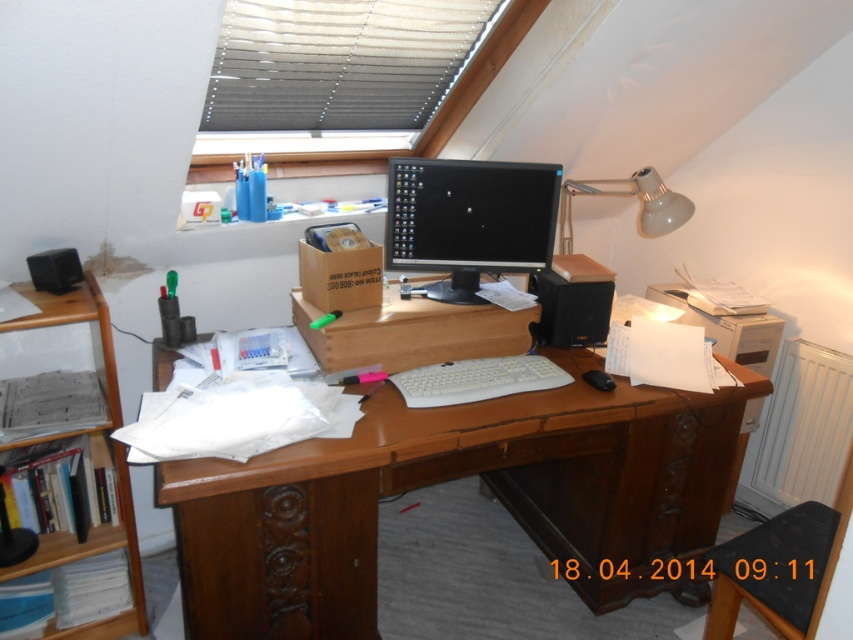
Question: Which is nearer to the brown wooden desk at center?

Choices:
 (A) white plastic keyboard at center
 (B) wooden at left
 (C) black glossy monitor at center

Answer: (A)

Question: Is black glossy monitor at center below cardboard box at center?

Choices:
 (A) no
 (B) yes

Answer: (A)

Question: Is black glossy monitor at center behind wooden at left?

Choices:
 (A) yes
 (B) no

Answer: (A)

Question: Which point appears farthest from the camera in this image?

Choices:
 (A) (393, 234)
 (B) (338, 228)
 (C) (439, 369)

Answer: (A)

Question: Which object is closer to the camera taking this photo?

Choices:
 (A) white plastic lamp at upper right
 (B) cardboard box at center
 (C) black glossy monitor at center
 (D) brown wooden desk at center

Answer: (D)

Question: Considering the relative positions of black glossy monitor at center and cardboard box at center in the image provided, where is black glossy monitor at center located with respect to cardboard box at center?

Choices:
 (A) above
 (B) below

Answer: (A)